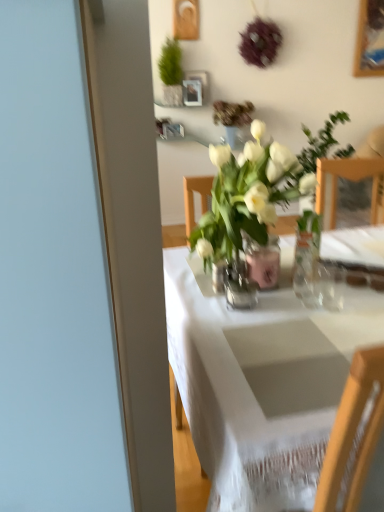
In order to click on free point in front of clear glass vase at center, the 2th vase viewed from the back in this screenshot , I will do `click(255, 335)`.